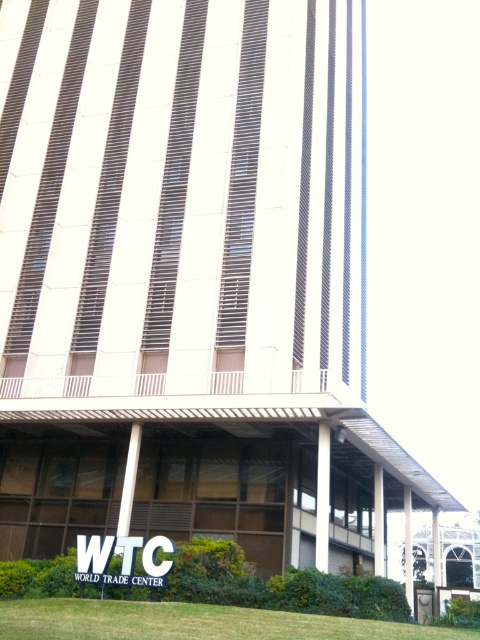
Question: Where is green grass at lower center located in relation to white plastic sign at center in the image?

Choices:
 (A) below
 (B) above

Answer: (A)

Question: Among these objects, which one is farthest from the camera?

Choices:
 (A) green grass at lower center
 (B) white plastic sign at center

Answer: (B)

Question: Can you confirm if green grass at lower center is positioned above white plastic sign at center?

Choices:
 (A) no
 (B) yes

Answer: (A)

Question: Does green grass at lower center appear under white plastic sign at center?

Choices:
 (A) yes
 (B) no

Answer: (A)

Question: Which point appears closest to the camera in this image?

Choices:
 (A) (129, 554)
 (B) (350, 632)

Answer: (B)